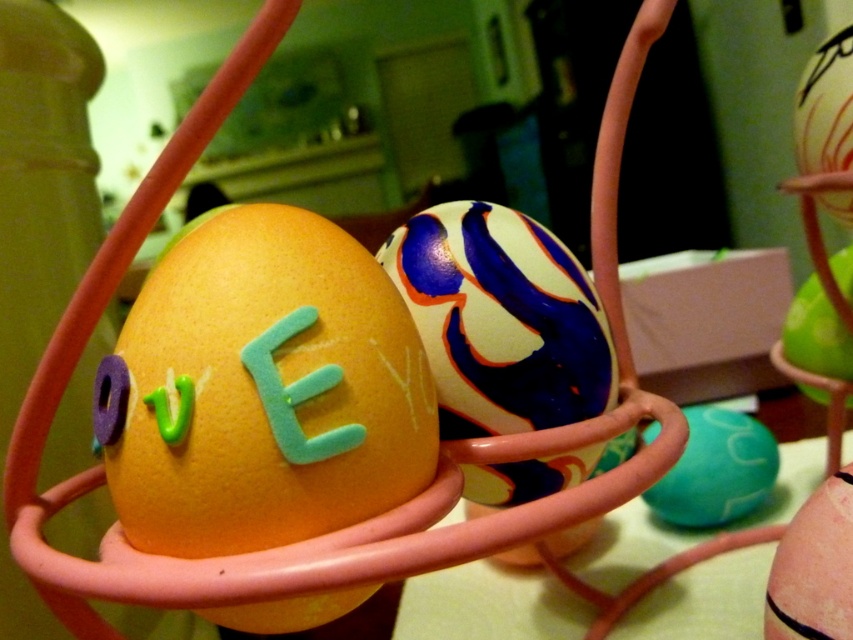
You are organizing an Easter egg hunt and need to place the matte teal egg at center and the green matte egg at center into a basket that is 10 inches wide. Can both eggs fit side by side in the basket?

The matte teal egg at center is 6.08 inches from the green matte egg at center, so the total space needed would be approximately 6.08 inches. Since the basket is 10 inches wide, there is enough space for both eggs to fit side by side.